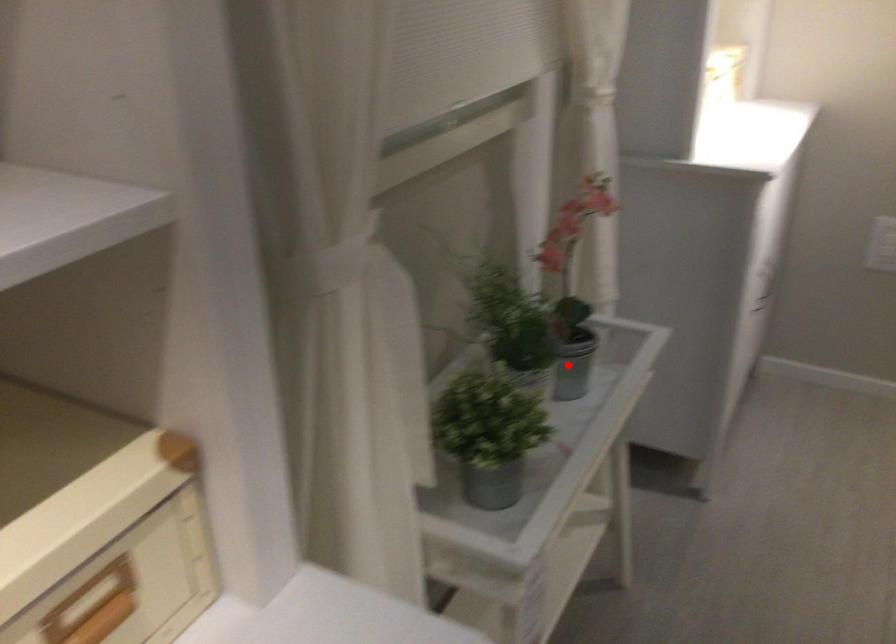
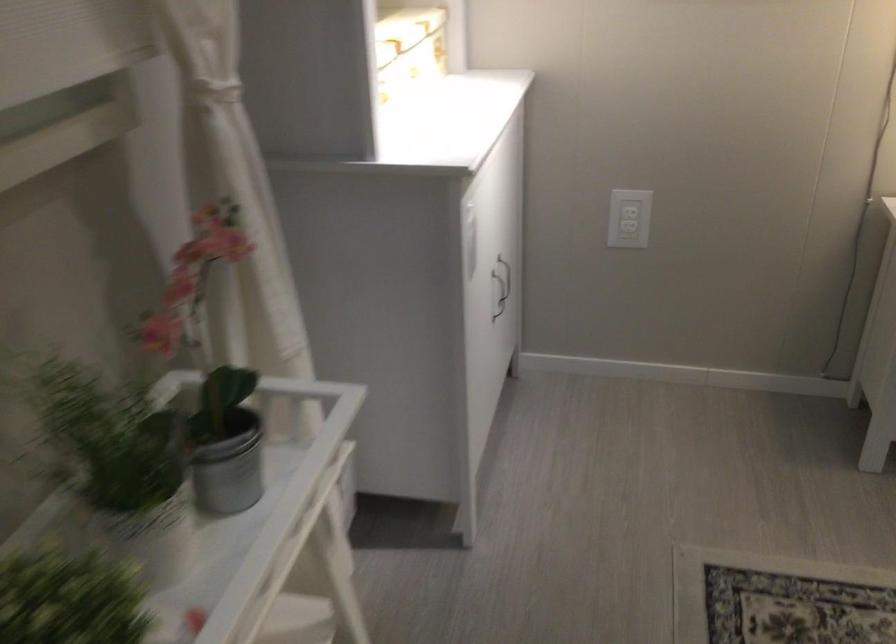
Locate, in the second image, the point that corresponds to the highlighted location in the first image.

(227, 462)